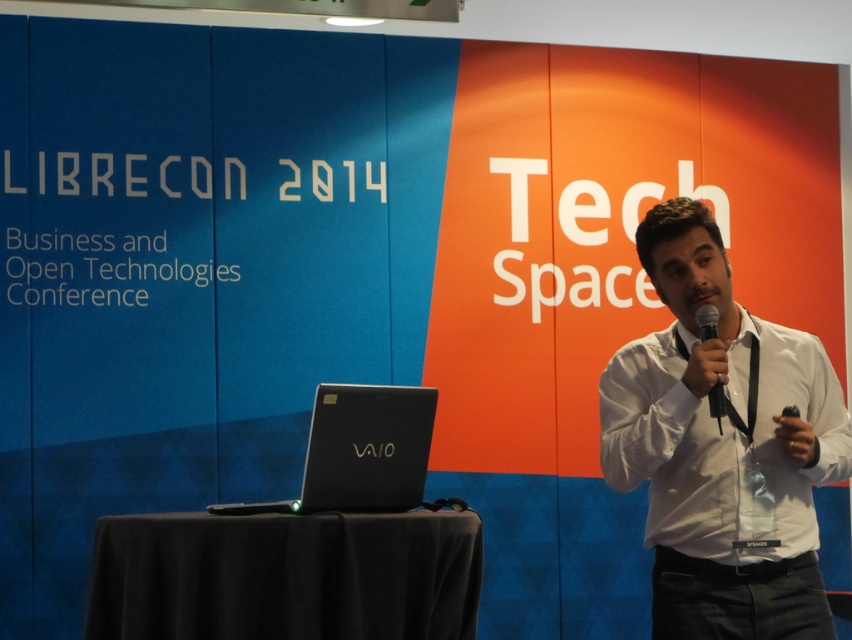
You are attending LibreCon 2014 and need to place a new object between the white shirt at center and the black matte vaio at lower left. Which side should you place it closer to ensure it fits without overlapping?

Since the white shirt at center is thinner than the black matte vaio at lower left, you should place the new object closer to the white shirt at center as it has a narrower width, allowing more space on the vaio side.

You are an attendee at LibreCon 2014. You see a speaker holding two items. Which item is positioned to the right of the other? The items are the white shirt at center and the black metallic microphone at center.

The white shirt at center is positioned to the right of the black metallic microphone at center.